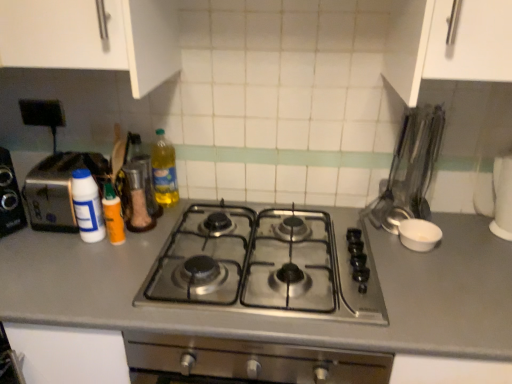
Question: Considering the relative sizes of white matte bowl at right, the first appliance ordered from the bottom, and translucent orange bottle at center left, which is counted as the second bottle, starting from the right, in the image provided, is white matte bowl at right, the first appliance ordered from the bottom, bigger than translucent orange bottle at center left, which is counted as the second bottle, starting from the right,?

Choices:
 (A) no
 (B) yes

Answer: (B)

Question: Is white matte bowl at right, the first appliance ordered from the bottom, facing towards translucent orange bottle at center left, which appears as the second bottle when viewed from the left?

Choices:
 (A) yes
 (B) no

Answer: (B)

Question: Is translucent orange bottle at center left, which is counted as the second bottle, starting from the right, surrounded by white matte bowl at right, the first appliance ordered from the bottom?

Choices:
 (A) yes
 (B) no

Answer: (B)

Question: Is white matte bowl at right, the first appliance ordered from the bottom, wider than translucent orange bottle at center left, which is counted as the second bottle, starting from the right?

Choices:
 (A) no
 (B) yes

Answer: (B)

Question: Does white matte bowl at right, the first appliance ordered from the bottom, appear on the right side of translucent orange bottle at center left, which is counted as the second bottle, starting from the right?

Choices:
 (A) yes
 (B) no

Answer: (A)

Question: Considering the relative sizes of white matte bowl at right, the first appliance ordered from the bottom, and translucent orange bottle at center left, which appears as the second bottle when viewed from the left, in the image provided, is white matte bowl at right, the first appliance ordered from the bottom, thinner than translucent orange bottle at center left, which appears as the second bottle when viewed from the left,?

Choices:
 (A) no
 (B) yes

Answer: (A)

Question: Can you confirm if silver metallic toaster at left is positioned to the left of translucent orange bottle at center left, which is counted as the second bottle, starting from the right?

Choices:
 (A) no
 (B) yes

Answer: (B)

Question: Is silver metallic toaster at left taller than translucent orange bottle at center left, which is counted as the second bottle, starting from the right?

Choices:
 (A) yes
 (B) no

Answer: (A)

Question: Is silver metallic toaster at left bigger than translucent orange bottle at center left, which appears as the second bottle when viewed from the left?

Choices:
 (A) no
 (B) yes

Answer: (B)

Question: Can you confirm if silver metallic toaster at left is positioned to the right of translucent orange bottle at center left, which is counted as the second bottle, starting from the right?

Choices:
 (A) no
 (B) yes

Answer: (A)

Question: Considering the relative sizes of silver metallic toaster at left and translucent orange bottle at center left, which appears as the second bottle when viewed from the left, in the image provided, is silver metallic toaster at left wider than translucent orange bottle at center left, which appears as the second bottle when viewed from the left,?

Choices:
 (A) yes
 (B) no

Answer: (A)

Question: Would you consider silver metallic toaster at left to be distant from translucent orange bottle at center left, which is counted as the second bottle, starting from the right?

Choices:
 (A) no
 (B) yes

Answer: (A)

Question: Could stainless steel gas stove at center be considered to be inside translucent plastic bottle at center, arranged as the first bottle when viewed from the right?

Choices:
 (A) yes
 (B) no

Answer: (B)